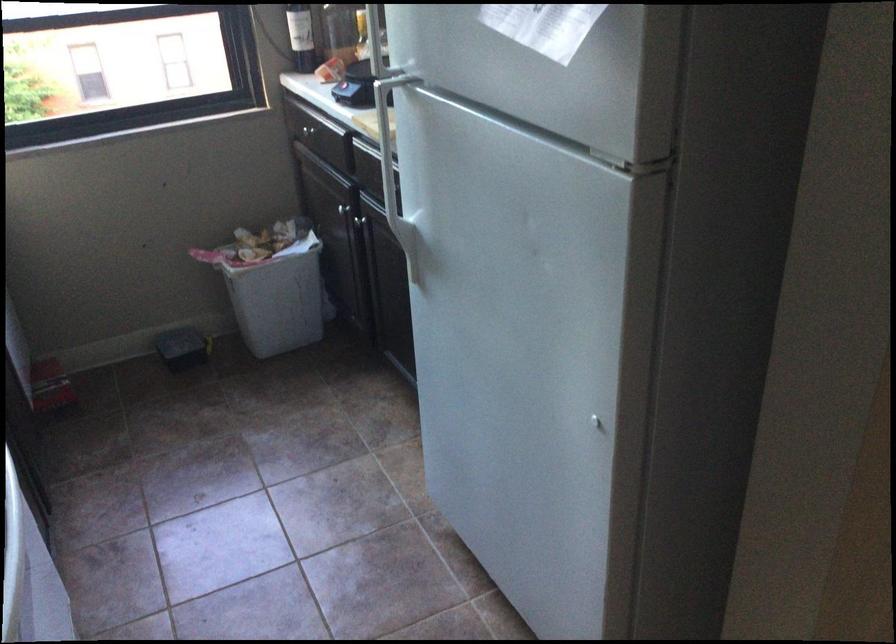
The width and height of the screenshot is (896, 644). What are the coordinates of `white refrigerator handle` in the screenshot? It's located at (398, 201).